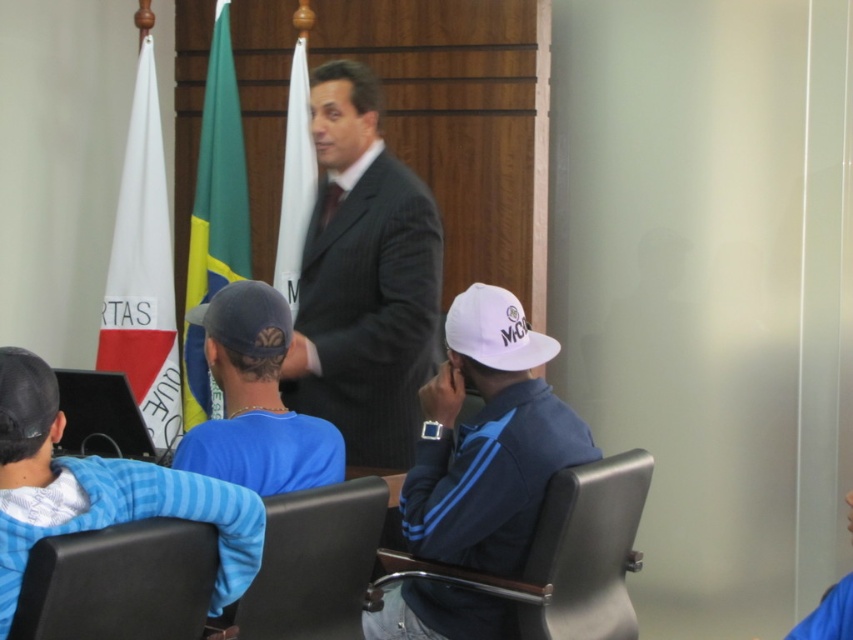
You are a photographer adjusting your camera settings to focus on two specific points in the scene. The first point is at coordinates point (241, 228) and the second point is at point (297, 253). Since the points are at different distances from the camera, which point should you focus on first to ensure the foreground subject is sharp?

Point (241, 228) is further to the camera than point (297, 253). Therefore, to focus on the foreground subject first, you should focus on point (241, 228).